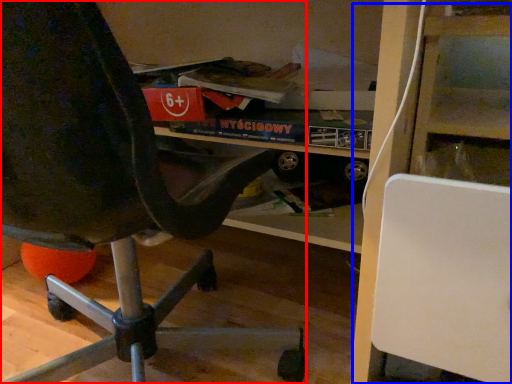
Question: Among these objects, which one is nearest to the camera, chair (highlighted by a red box) or shelf (highlighted by a blue box)?

Choices:
 (A) chair
 (B) shelf

Answer: (A)